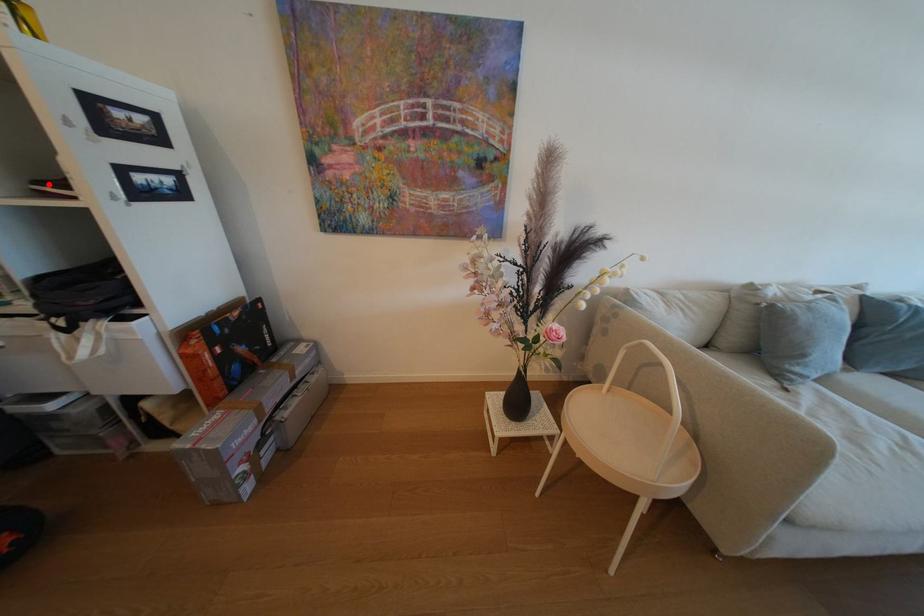
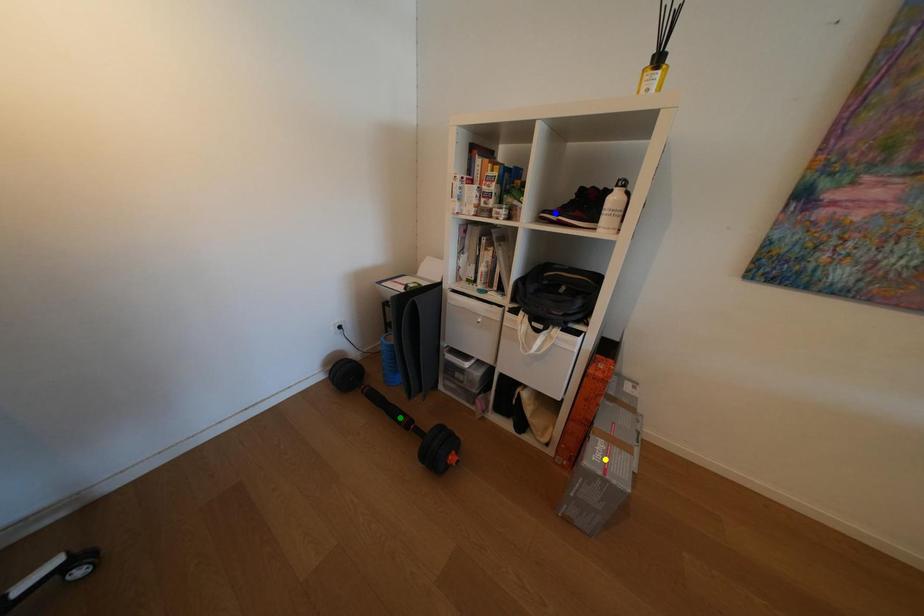
Question: I am providing you with two images of the same scene from different viewpoints. A red point is marked on the first image. You are given multiple points on the second image. Which spot in image 2 lines up with the point in image 1?

Choices:
 (A) yellow point
 (B) blue point
 (C) green point

Answer: (B)